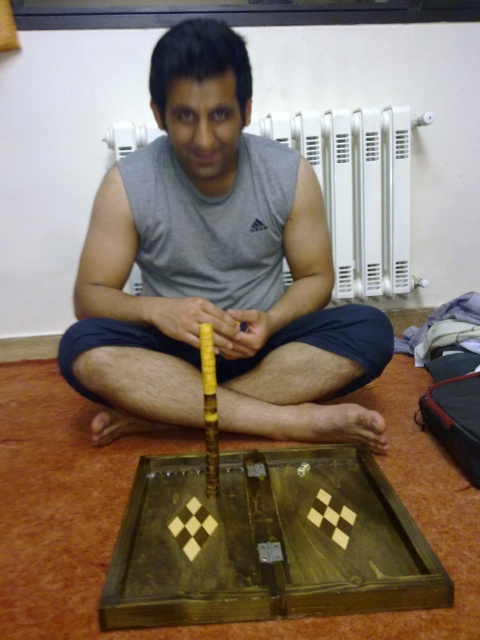
Question: Observing the image, what is the correct spatial positioning of gray matte tank top at center in reference to white plastic radiator at upper center?

Choices:
 (A) above
 (B) below

Answer: (B)

Question: Does gray matte tank top at center appear on the left side of white plastic radiator at upper center?

Choices:
 (A) yes
 (B) no

Answer: (A)

Question: Can you confirm if gray matte tank top at center is wider than white plastic radiator at upper center?

Choices:
 (A) yes
 (B) no

Answer: (A)

Question: Which of the following is the farthest from the observer?

Choices:
 (A) [x=302, y=131]
 (B) [x=382, y=420]

Answer: (A)

Question: Which point is farther to the camera?

Choices:
 (A) (408, 260)
 (B) (218, 192)

Answer: (A)